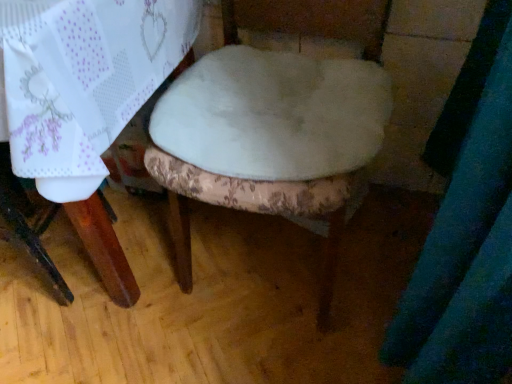
I want to click on free spot below white fabric chair at center (from a real-world perspective), so click(268, 254).